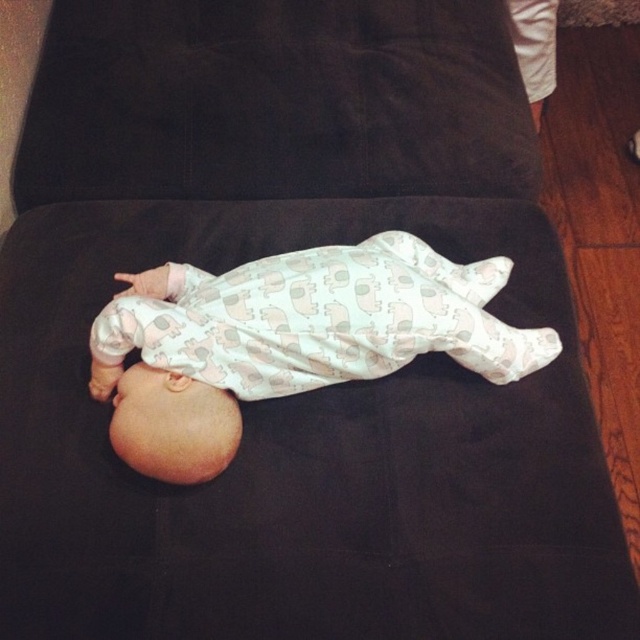
Question: Which point is closer to the camera taking this photo?

Choices:
 (A) (209, 477)
 (B) (516, 140)

Answer: (A)

Question: Does black suede pillow at center have a larger size compared to white printed fabric baby at center?

Choices:
 (A) yes
 (B) no

Answer: (B)

Question: Which point appears farthest from the camera in this image?

Choices:
 (A) (486, 291)
 (B) (150, 44)

Answer: (B)

Question: Is black suede pillow at center wider than white printed fabric baby at center?

Choices:
 (A) yes
 (B) no

Answer: (A)

Question: Which object is closer to the camera taking this photo?

Choices:
 (A) white printed fabric baby at center
 (B) black suede pillow at center

Answer: (A)

Question: Can you confirm if black suede pillow at center is wider than white printed fabric baby at center?

Choices:
 (A) no
 (B) yes

Answer: (B)